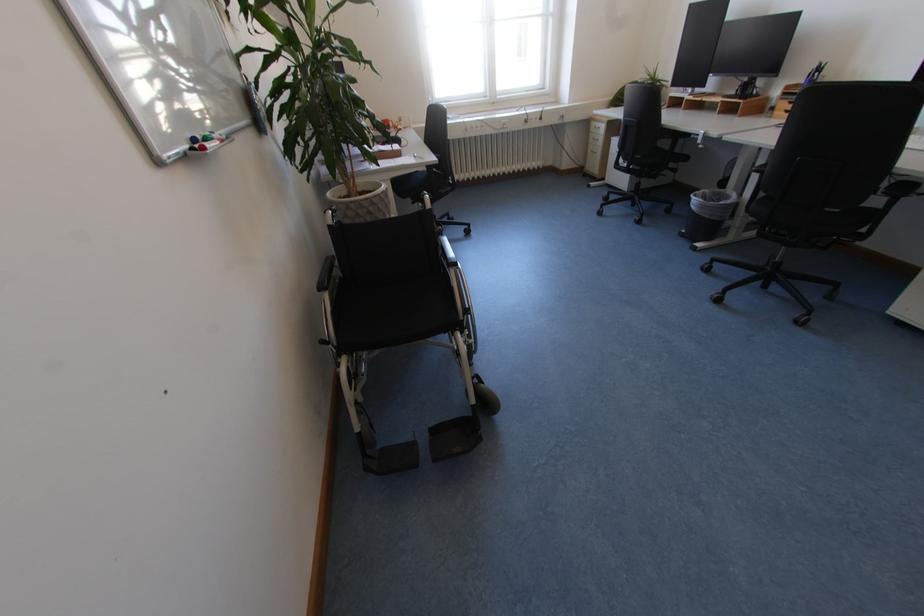
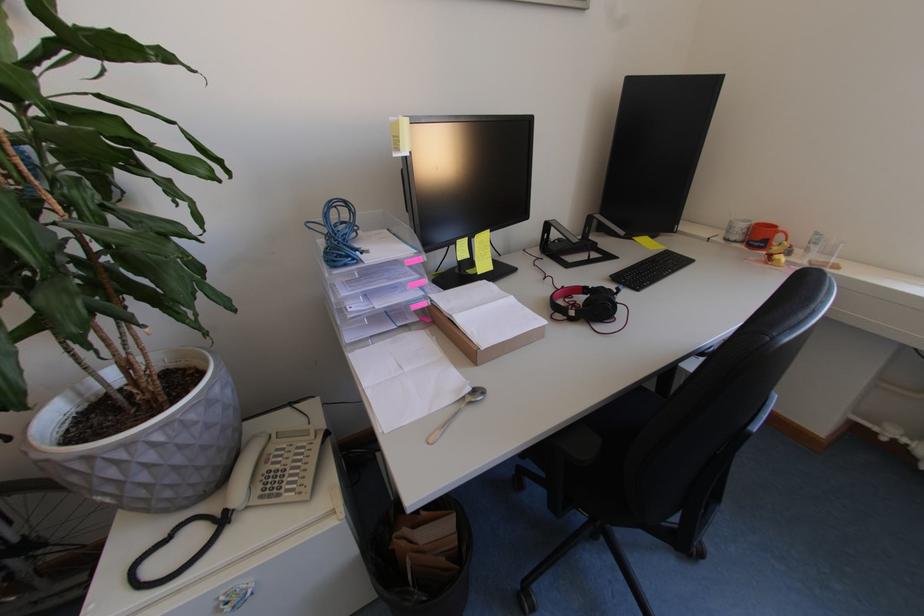
Find the pixel in the second image that matches (x=397, y=124) in the first image.

(786, 238)